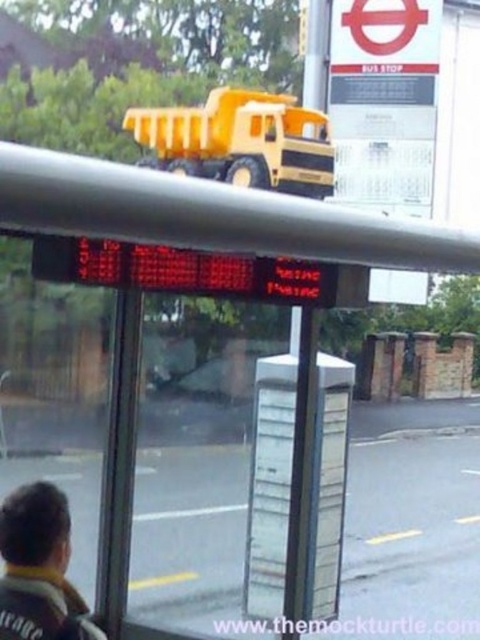
You are a delivery person who needs to place a package on the bus stop roof where the yellow matte toy truck at upper center is located. However, you must ensure that the package does not block the view of the dark brown leather jacket at lower left. Can you do this?

The yellow matte toy truck at upper center is positioned on the right side of the dark brown leather jacket at lower left. Since the toy truck is on the right, placing the package there would not block the view of the dark brown leather jacket at lower left as long as it stays to the right.

You are a delivery person trying to place a new yellow matte toy truck at upper center on the bus shelter roof. The truck is wider than the dark brown leather jacket at lower left. Will the toy truck fit on the roof if the jacket is currently occupying the space?

The yellow matte toy truck at upper center is wider than the dark brown leather jacket at lower left. Since the jacket is occupying the space, the toy truck may not fit unless the jacket is moved.